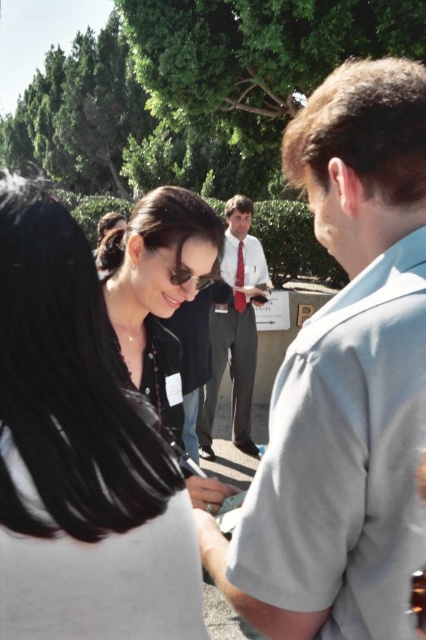
Who is more distant from viewer, (169, 200) or (238, 288)?

Positioned behind is point (238, 288).

Looking at this image, between matte black shirt at center and red satin tie at center, which one has less height?

red satin tie at center

Is point (186, 216) positioned behind point (236, 269)?

No, (186, 216) is closer to viewer.

This screenshot has height=640, width=426. I want to click on matte black shirt at center, so click(158, 288).

Is light gray shirt at center closer to camera compared to red satin tie at center?

Yes, it is.

Who is shorter, light gray shirt at center or red satin tie at center?

red satin tie at center is shorter.

Who is more forward, (x=394, y=522) or (x=241, y=268)?

Positioned in front is point (x=394, y=522).

Where is `light gray shirt at center`? This screenshot has height=640, width=426. light gray shirt at center is located at coordinates (x=344, y=381).

Where is `matte black jacket at center`? The image size is (426, 640). matte black jacket at center is located at coordinates (80, 452).

Which is in front, point (77, 435) or point (241, 356)?

Point (77, 435) is more forward.

Which is behind, point (17, 577) or point (250, 444)?

Point (250, 444)

The height and width of the screenshot is (640, 426). In order to click on matte black jacket at center in this screenshot , I will do `click(80, 452)`.